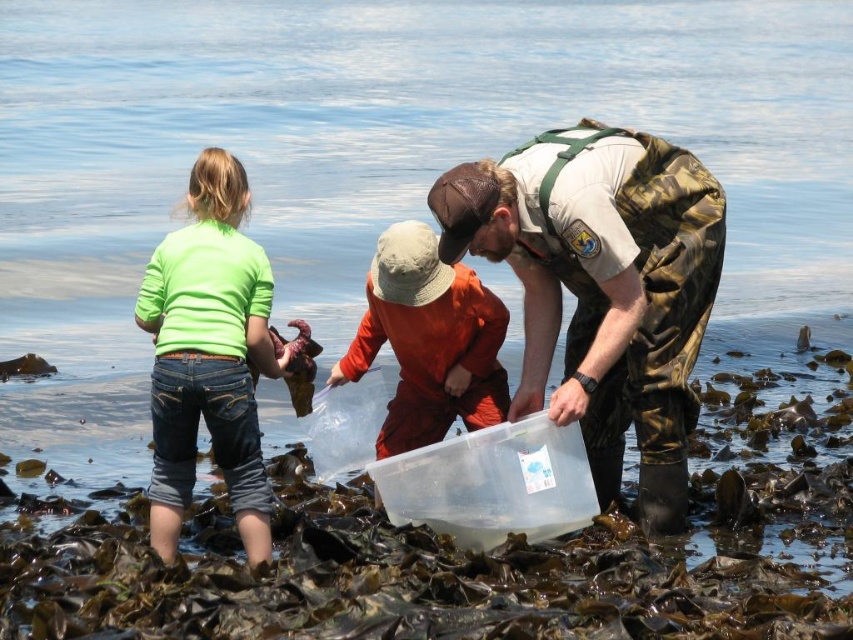
Question: Which is nearer to the orange cotton shirt at center?

Choices:
 (A) green matte shirt at left
 (B) camouflage pants at center

Answer: (B)

Question: Does camouflage pants at center come behind orange cotton shirt at center?

Choices:
 (A) yes
 (B) no

Answer: (B)

Question: In this image, where is camouflage pants at center located relative to green matte shirt at left?

Choices:
 (A) above
 (B) below

Answer: (A)

Question: Based on their relative distances, which object is nearer to the orange cotton shirt at center?

Choices:
 (A) green matte shirt at left
 (B) camouflage pants at center

Answer: (B)

Question: Which object is positioned closest to the orange cotton shirt at center?

Choices:
 (A) green matte shirt at left
 (B) camouflage pants at center

Answer: (B)

Question: Can you confirm if camouflage pants at center is positioned above green matte shirt at left?

Choices:
 (A) yes
 (B) no

Answer: (A)